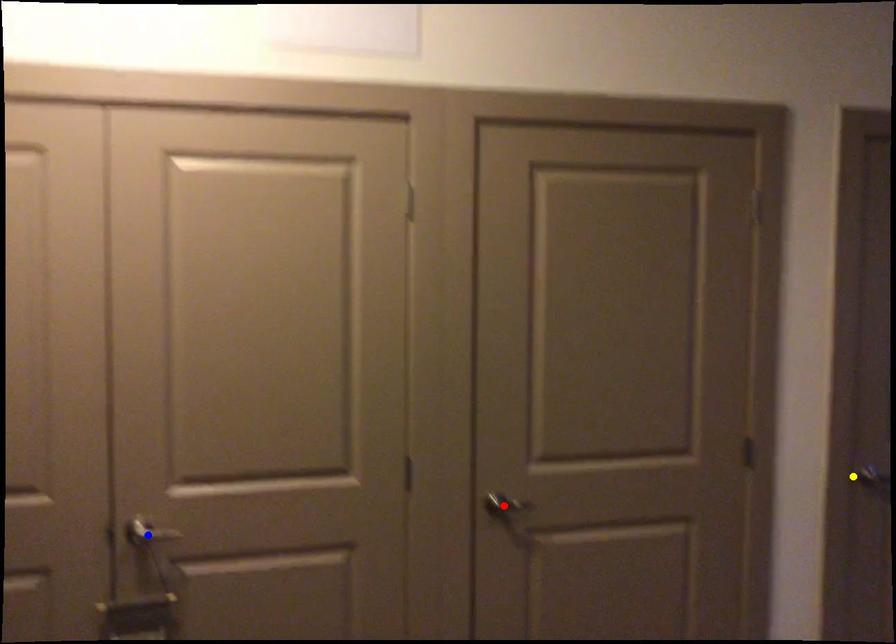
Order these from nearest to farthest:
yellow point, red point, blue point

blue point, red point, yellow point